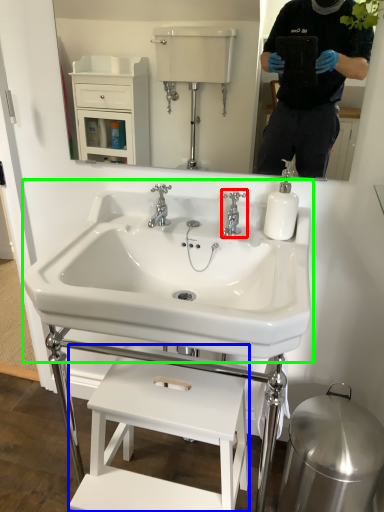
Question: Which is farther away from tap (highlighted by a red box)? furniture (highlighted by a blue box) or sink (highlighted by a green box)?

Choices:
 (A) furniture
 (B) sink

Answer: (A)